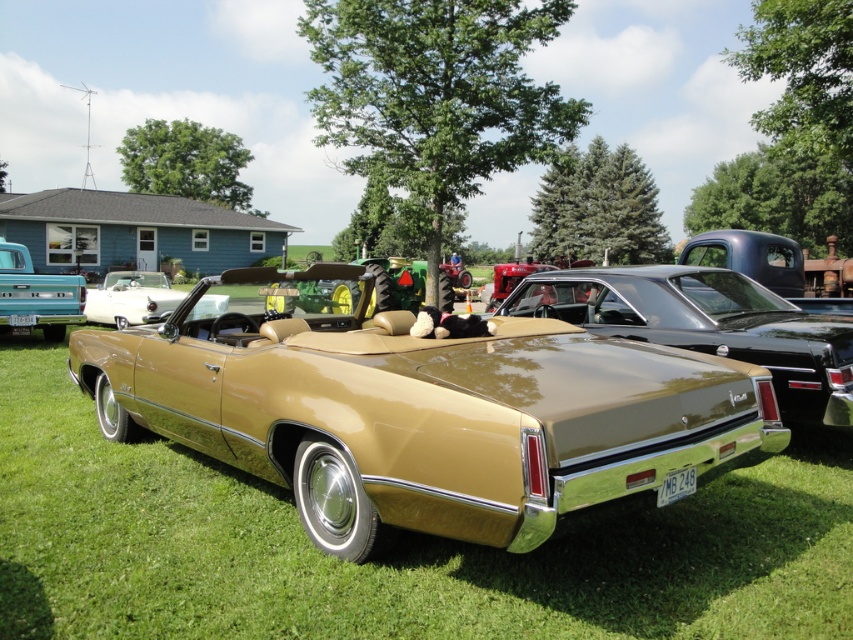
Question: Does teal glossy truck at left have a smaller size compared to matte gold convertible at center?

Choices:
 (A) no
 (B) yes

Answer: (B)

Question: Which object appears farthest from the camera in this image?

Choices:
 (A) matte gold convertible at center
 (B) gold glossy convertible at center
 (C) teal glossy truck at left

Answer: (C)

Question: Does gold matte car at center appear on the right side of teal glossy truck at left?

Choices:
 (A) yes
 (B) no

Answer: (A)

Question: Which object appears closest to the camera in this image?

Choices:
 (A) gold glossy convertible at center
 (B) matte gold convertible at center

Answer: (A)

Question: Does gold glossy convertible at center have a lesser width compared to gold matte car at center?

Choices:
 (A) yes
 (B) no

Answer: (A)

Question: Which point is closer to the camera?

Choices:
 (A) (543, 291)
 (B) (358, 461)
 (C) (21, 250)
 (D) (128, 323)

Answer: (B)